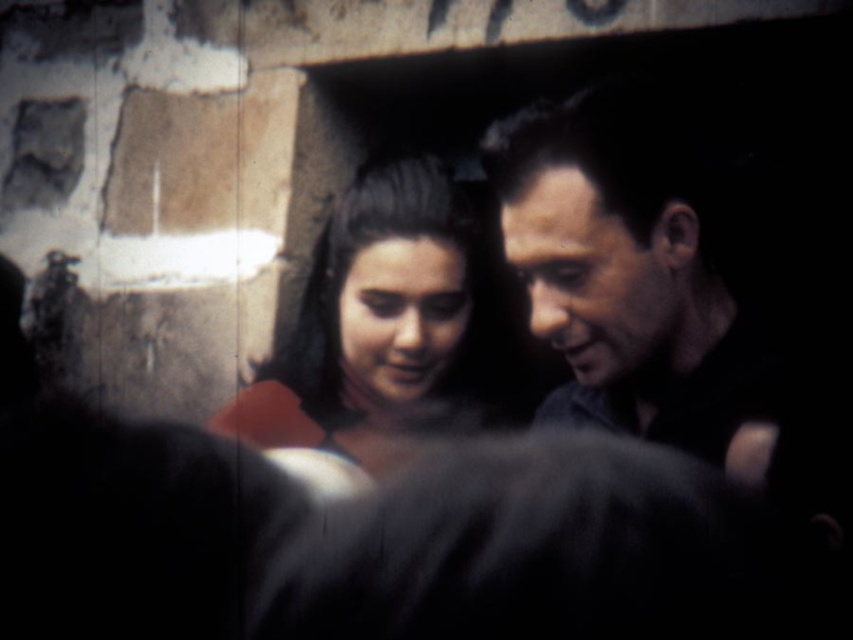
Question: Does smooth dark hair at right have a smaller size compared to matte red dress at center?

Choices:
 (A) no
 (B) yes

Answer: (B)

Question: Which of the following is the farthest from the observer?

Choices:
 (A) smooth dark hair at right
 (B) matte red dress at center

Answer: (B)

Question: Does smooth dark hair at right have a larger size compared to matte red dress at center?

Choices:
 (A) no
 (B) yes

Answer: (A)

Question: Can you confirm if smooth dark hair at right is wider than matte red dress at center?

Choices:
 (A) no
 (B) yes

Answer: (A)

Question: Which object is farther from the camera taking this photo?

Choices:
 (A) smooth dark hair at right
 (B) matte red dress at center

Answer: (B)

Question: Which point appears closest to the camera in this image?

Choices:
 (A) (546, 209)
 (B) (407, 397)

Answer: (A)